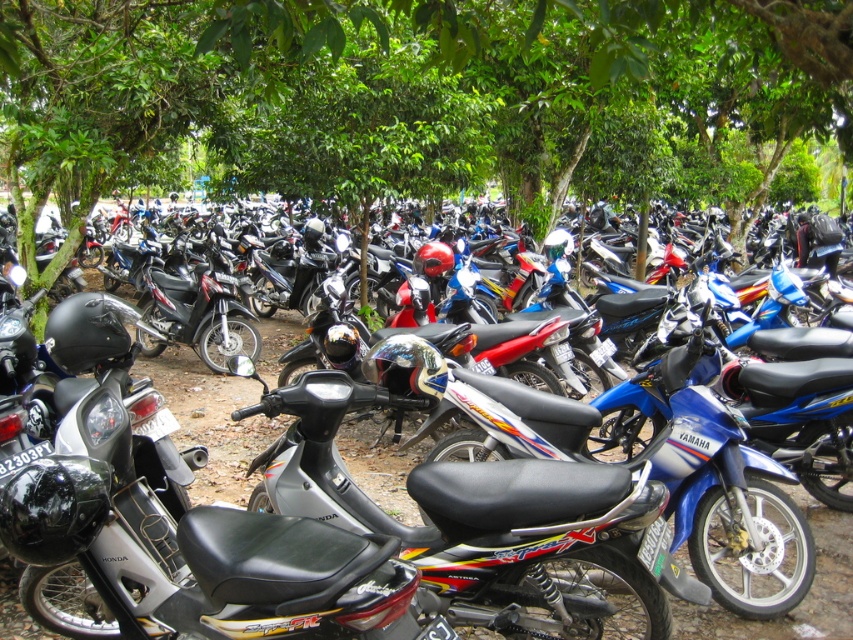
You are standing at the point marked as point (x=412, y=93) in the parking area. What object is exactly at your current location?

The green leafy tree at center is exactly at point (x=412, y=93).